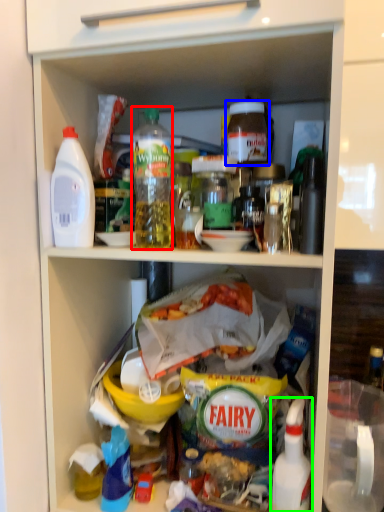
Question: Which is nearer to the bottle (highlighted by a red box)? bottle (highlighted by a blue box) or bottle (highlighted by a green box).

Choices:
 (A) bottle
 (B) bottle

Answer: (A)